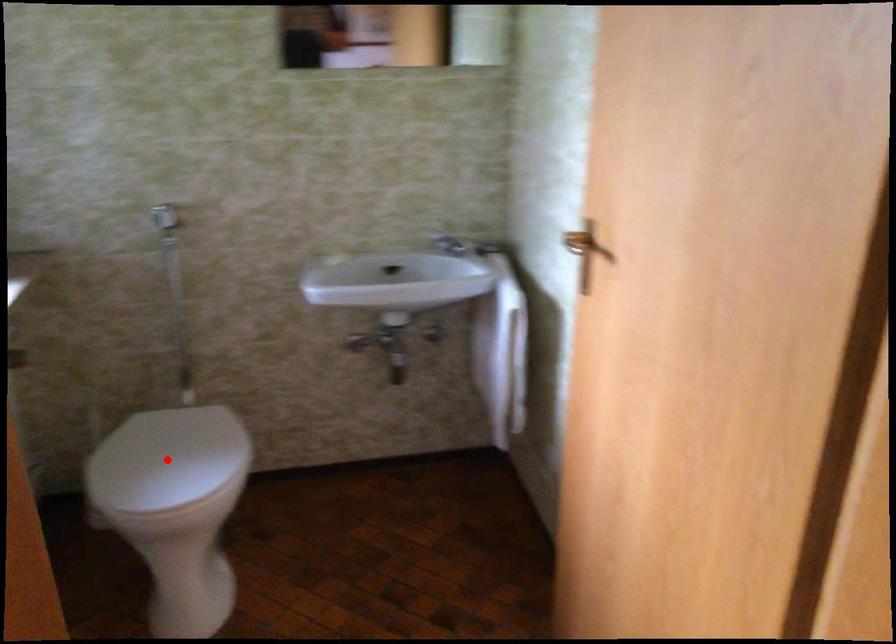
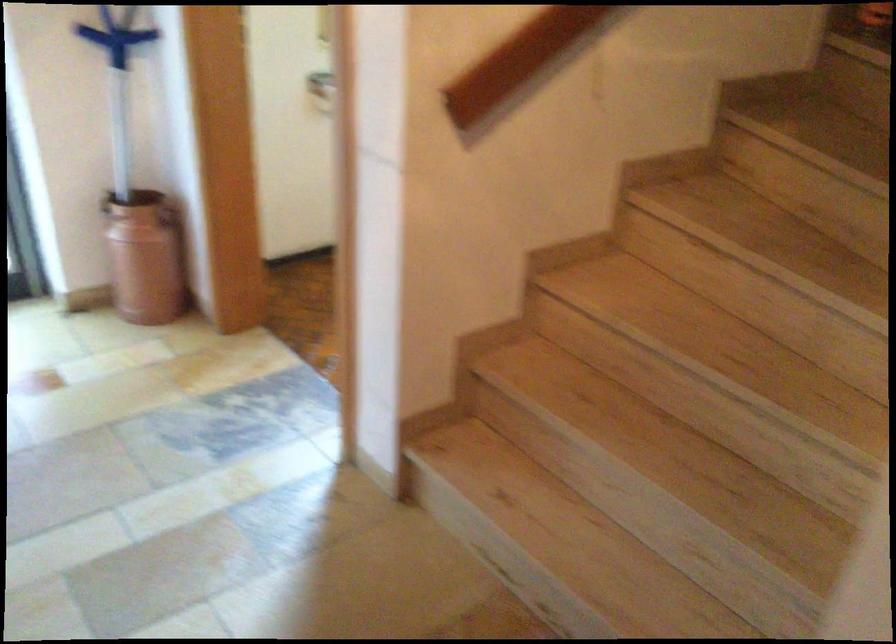
Question: I am providing you with two images of the same scene from different viewpoints. A red point is marked on the first image. At the location where the point appears in image 1, is it still visible in image 2?

Choices:
 (A) Yes
 (B) No

Answer: (B)